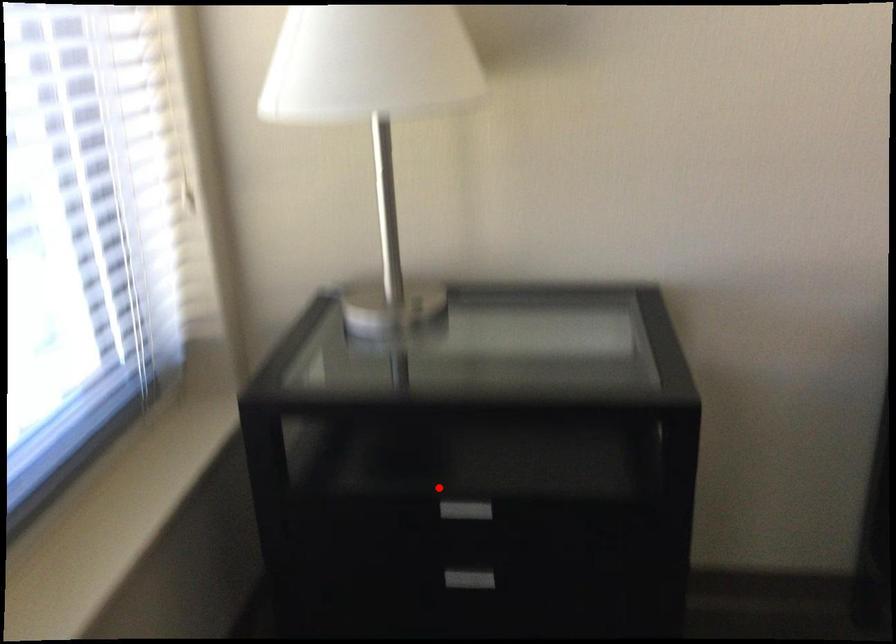
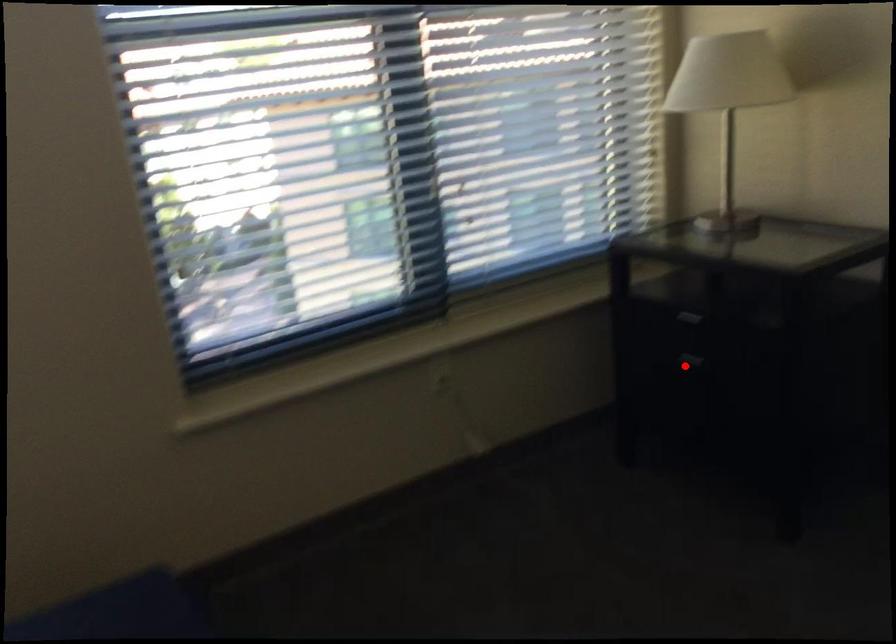
I am providing you with two images of the same scene from different viewpoints. A red point is marked on the first image and another point is marked on the second image. Do the highlighted points in image1 and image2 indicate the same real-world spot?

No